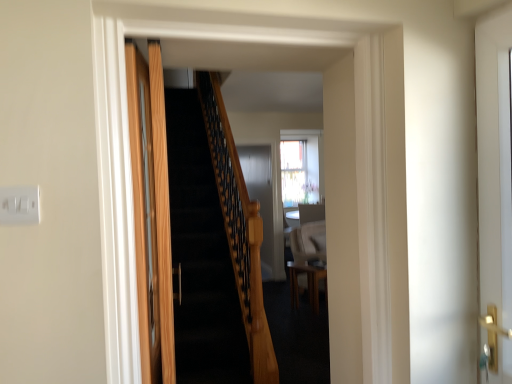
I want to click on wooden table at center, so click(x=307, y=283).

The width and height of the screenshot is (512, 384). Describe the element at coordinates (307, 283) in the screenshot. I see `wooden table at center` at that location.

What do you see at coordinates (494, 162) in the screenshot? The image size is (512, 384). I see `white glossy door at right, the first door viewed from the right` at bounding box center [494, 162].

This screenshot has width=512, height=384. Find the location of `white plastic/light switch at upper left`. white plastic/light switch at upper left is located at coordinates (20, 205).

Identify the location of wooden table at center. The height and width of the screenshot is (384, 512). (307, 283).

From the image's perspective, is wooden table at center below white plastic/light switch at upper left?

Correct, wooden table at center appears lower than white plastic/light switch at upper left in the image.

From a real-world perspective, is wooden table at center under white plastic/light switch at upper left?

Indeed, from a real-world perspective, wooden table at center is positioned beneath white plastic/light switch at upper left.

Which object is closer to the camera taking this photo, wooden table at center or white plastic/light switch at upper left?

white plastic/light switch at upper left is more forward.

Is wooden door at left, the 2th door positioned from the right, in front of wooden table at center?

Yes, the depth of wooden door at left, the 2th door positioned from the right, is less than that of wooden table at center.

Considering the sizes of wooden door at left, the 2th door positioned from the right, and wooden table at center in the image, is wooden door at left, the 2th door positioned from the right, bigger or smaller than wooden table at center?

wooden door at left, the 2th door positioned from the right, is smaller than wooden table at center.

In the scene shown: Which point is more forward, (165, 262) or (324, 268)?

Positioned in front is point (165, 262).

Visually, is wooden door at left, the 2th door positioned from the right, positioned to the left or to the right of wooden table at center?

Clearly, wooden door at left, the 2th door positioned from the right, is on the left of wooden table at center in the image.

Is white glossy door at right, arranged as the 2th door when viewed from the left, far from white plastic/light switch at upper left?

Yes, white glossy door at right, arranged as the 2th door when viewed from the left, is far from white plastic/light switch at upper left.

Which is correct: white glossy door at right, the first door viewed from the right, is inside white plastic/light switch at upper left, or outside of it?

white glossy door at right, the first door viewed from the right, cannot be found inside white plastic/light switch at upper left.

Is white glossy door at right, arranged as the 2th door when viewed from the left, at the right side of white plastic/light switch at upper left?

Indeed, white glossy door at right, arranged as the 2th door when viewed from the left, is positioned on the right side of white plastic/light switch at upper left.

Between white glossy door at right, arranged as the 2th door when viewed from the left, and white plastic/light switch at upper left, which one has smaller width?

white plastic/light switch at upper left is thinner.

From a real-world perspective, which object rests below the other?

From a 3D spatial view, wooden table at center is below.

Is point (483, 141) closer or farther from the camera than point (308, 270)?

Clearly, point (483, 141) is closer to the camera than point (308, 270).

Is white glossy door at right, the first door viewed from the right, far away from wooden table at center?

Indeed, white glossy door at right, the first door viewed from the right, is not near wooden table at center.

Choose the correct answer: Is white glossy door at right, the first door viewed from the right, inside wooden table at center or outside it?

white glossy door at right, the first door viewed from the right, is outside wooden table at center.

From a real-world perspective, is white plastic/light switch at upper left located beneath white glossy door at right, the first door viewed from the right?

Incorrect, from a real-world perspective, white plastic/light switch at upper left is higher than white glossy door at right, the first door viewed from the right.

Which is more to the left, white plastic/light switch at upper left or white glossy door at right, the first door viewed from the right?

white plastic/light switch at upper left.

Is white plastic/light switch at upper left not within white glossy door at right, the first door viewed from the right?

Yes, white plastic/light switch at upper left is outside of white glossy door at right, the first door viewed from the right.

Is wooden table at center completely or partially outside of white glossy door at right, arranged as the 2th door when viewed from the left?

Absolutely, wooden table at center is external to white glossy door at right, arranged as the 2th door when viewed from the left.

Does wooden table at center lie behind white glossy door at right, the first door viewed from the right?

Yes, it is behind white glossy door at right, the first door viewed from the right.

From a real-world perspective, relative to white glossy door at right, arranged as the 2th door when viewed from the left, is wooden table at center vertically above or below?

From a real-world perspective, wooden table at center is physically below white glossy door at right, arranged as the 2th door when viewed from the left.

Does wooden table at center have a lesser width compared to white glossy door at right, the first door viewed from the right?

No, wooden table at center is not thinner than white glossy door at right, the first door viewed from the right.

From a real-world perspective, who is located lower, wooden table at center or wooden door at left, which is the 1th door from left to right?

In real-world perspective, wooden table at center is lower.

Does wooden table at center lie behind wooden door at left, the 2th door positioned from the right?

Yes, it is behind wooden door at left, the 2th door positioned from the right.

Is wooden door at left, which is the 1th door from left to right, a part of wooden table at center?

No, wooden table at center does not contain wooden door at left, which is the 1th door from left to right.

Starting from the wooden table at center, which door is the 2nd one in front? Please provide its 2D coordinates.

[(151, 212)]

This screenshot has width=512, height=384. Find the location of `table below the white plastic/light switch at upper left (from the image's perspective)`. table below the white plastic/light switch at upper left (from the image's perspective) is located at coordinates (307, 283).

The image size is (512, 384). What are the coordinates of `table below the wooden door at left, which is the 1th door from left to right (from a real-world perspective)` in the screenshot? It's located at (307, 283).

When comparing their distances from white glossy door at right, arranged as the 2th door when viewed from the left, does wooden door at left, the 2th door positioned from the right, or wooden table at center seem closer?

The object closer to white glossy door at right, arranged as the 2th door when viewed from the left, is wooden door at left, the 2th door positioned from the right.

Which object lies further to the anchor point white glossy door at right, the first door viewed from the right, wooden table at center or wooden door at left, which is the 1th door from left to right?

wooden table at center lies further to white glossy door at right, the first door viewed from the right, than the other object.

From the image, which object appears to be farther from wooden table at center, white glossy door at right, the first door viewed from the right, or wooden door at left, the 2th door positioned from the right?

The object further to wooden table at center is white glossy door at right, the first door viewed from the right.

Which object lies nearer to the anchor point white glossy door at right, the first door viewed from the right, white plastic/light switch at upper left or wooden door at left, the 2th door positioned from the right?

wooden door at left, the 2th door positioned from the right.

When comparing their distances from wooden table at center, does wooden door at left, the 2th door positioned from the right, or white glossy door at right, arranged as the 2th door when viewed from the left, seem further?

white glossy door at right, arranged as the 2th door when viewed from the left, is positioned further to the anchor wooden table at center.

When comparing their distances from white plastic/light switch at upper left, does white glossy door at right, arranged as the 2th door when viewed from the left, or wooden door at left, which is the 1th door from left to right, seem further?

white glossy door at right, arranged as the 2th door when viewed from the left, lies further to white plastic/light switch at upper left than the other object.

Which object lies nearer to the anchor point wooden door at left, the 2th door positioned from the right, white plastic/light switch at upper left or white glossy door at right, arranged as the 2th door when viewed from the left?

white plastic/light switch at upper left is positioned closer to the anchor wooden door at left, the 2th door positioned from the right.

Based on their spatial positions, is wooden table at center or wooden door at left, the 2th door positioned from the right, further from white plastic/light switch at upper left?

wooden table at center is further to white plastic/light switch at upper left.

This screenshot has height=384, width=512. What are the coordinates of `door situated between white plastic/light switch at upper left and white glossy door at right, arranged as the 2th door when viewed from the left, from left to right` in the screenshot? It's located at (151, 212).

Identify the location of door between wooden door at left, which is the 1th door from left to right, and wooden table at center in the front-back direction. This screenshot has height=384, width=512. (494, 162).